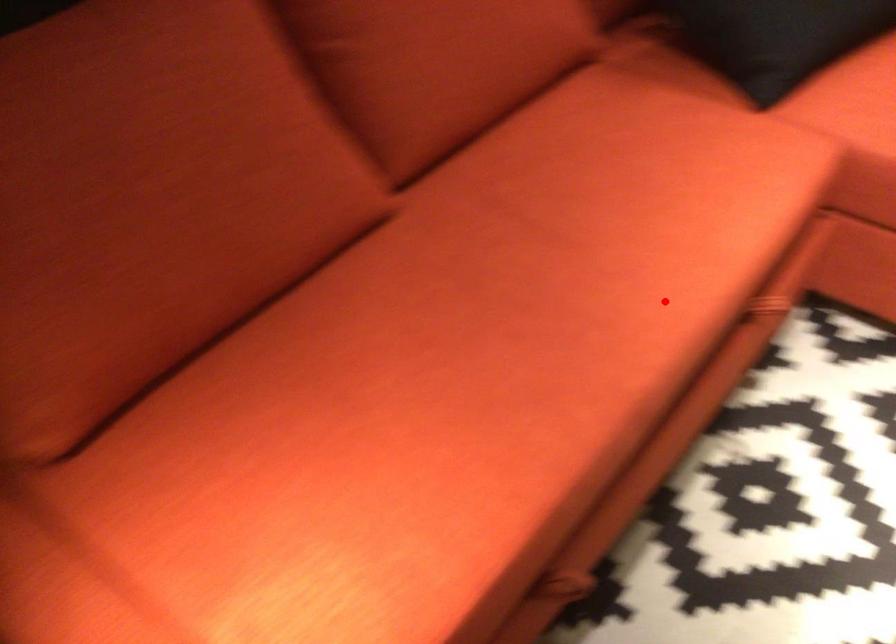
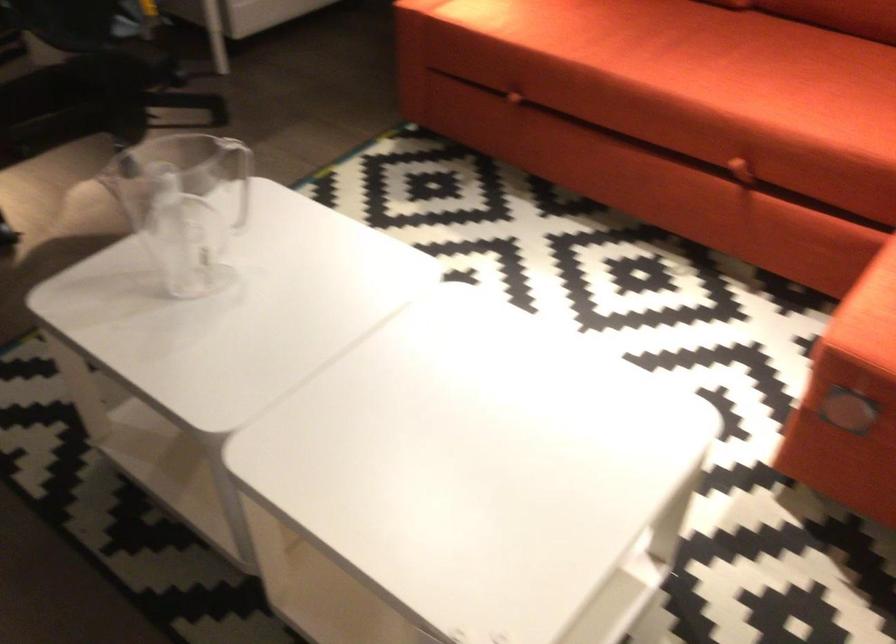
Locate, in the second image, the point that corresponds to the highlighted location in the first image.

(688, 80)